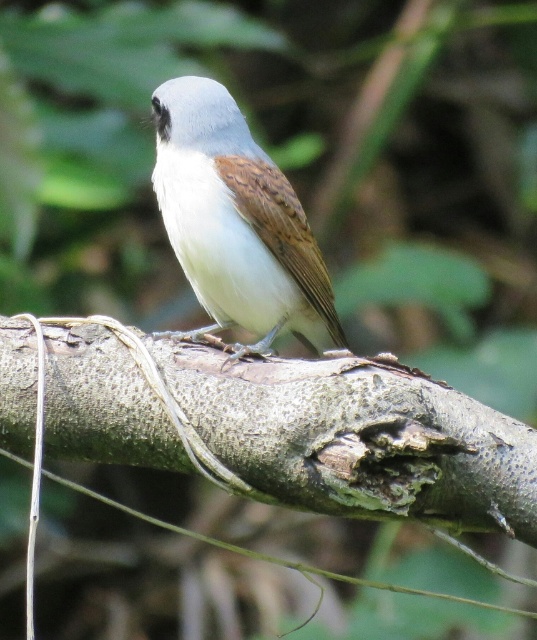
Is rough bark branch at center smaller than white matte bird at center?

No.

Does rough bark branch at center have a lesser height compared to white matte bird at center?

Yes.

Find the location of `rough bark branch at center`. rough bark branch at center is located at coordinates (265, 426).